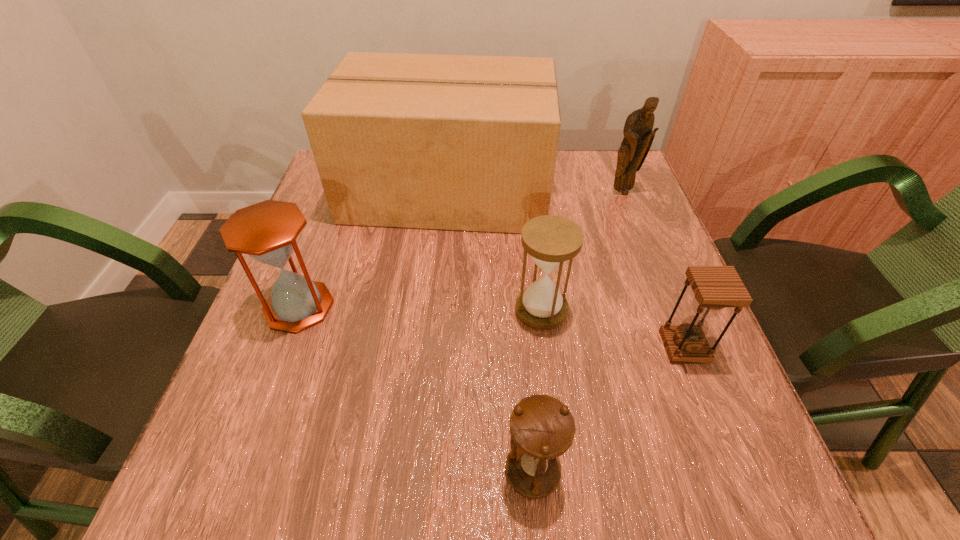
Locate an element on the screen. The width and height of the screenshot is (960, 540). box situated at the far edge is located at coordinates (455, 142).

In order to click on figurine positioned at the far edge in this screenshot , I will do `click(638, 136)`.

This screenshot has width=960, height=540. I want to click on object at the near edge, so click(x=542, y=428).

Image resolution: width=960 pixels, height=540 pixels. I want to click on box located in the left edge section of the desktop, so [455, 142].

Find the location of a particular element. This screenshot has width=960, height=540. hourglass that is at the left edge is located at coordinates (267, 231).

Locate an element on the screen. This screenshot has width=960, height=540. figurine that is at the right edge is located at coordinates (638, 136).

The image size is (960, 540). Find the location of `hourglass that is at the right edge`. hourglass that is at the right edge is located at coordinates (715, 287).

You are a GUI agent. You are given a task and a screenshot of the screen. Output one action in this format:
    pyautogui.click(x=<x>, y=<y>)
    Task: Click on the object that is at the far left corner
    
    Given the screenshot: What is the action you would take?
    pyautogui.click(x=455, y=142)

You are a GUI agent. You are given a task and a screenshot of the screen. Output one action in this format:
    pyautogui.click(x=<x>, y=<y>)
    Task: Click on the object that is at the far right corner
    This screenshot has height=540, width=960.
    Given the screenshot: What is the action you would take?
    pyautogui.click(x=638, y=136)

Identify the location of free location at the near edge of the desktop. The height and width of the screenshot is (540, 960). (506, 512).